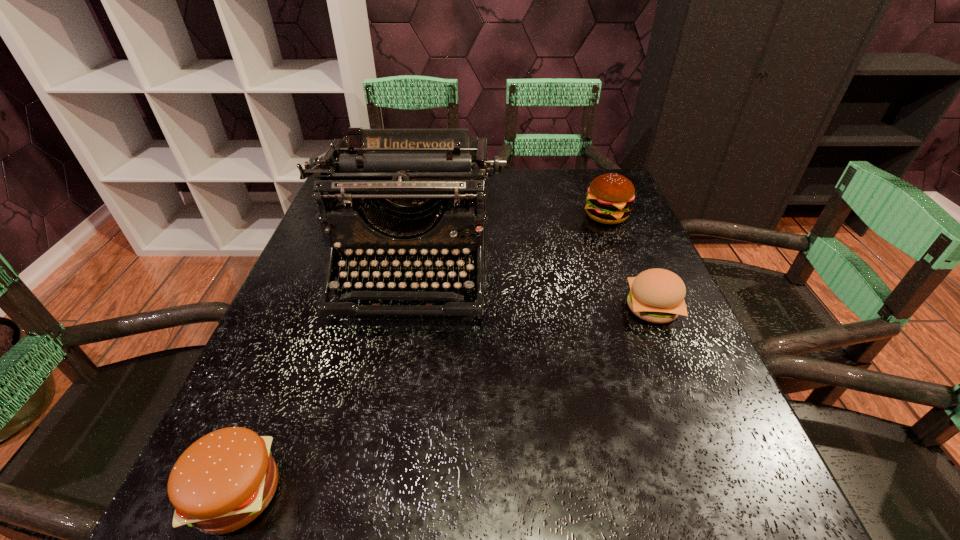
You are a GUI agent. You are given a task and a screenshot of the screen. Output one action in this format:
    pyautogui.click(x=<x>, y=<y>)
    Task: Click on the tallest object
    
    Given the screenshot: What is the action you would take?
    pyautogui.click(x=419, y=170)

In order to click on the second tallest object in this screenshot , I will do `click(610, 196)`.

Where is `the tallest hamburger`? The image size is (960, 540). the tallest hamburger is located at coordinates (610, 196).

Locate an element on the screen. the second farthest hamburger is located at coordinates (656, 295).

At what (x,y) coordinates should I click in order to perform the action: click on free region located 0.110m on the typing side of the typewriter. Please return your answer as a coordinate pair (x, y). This screenshot has width=960, height=540. Looking at the image, I should click on (393, 374).

Where is `vacant space located 0.060m on the back of the farthest hamburger`? The image size is (960, 540). vacant space located 0.060m on the back of the farthest hamburger is located at coordinates (597, 191).

The width and height of the screenshot is (960, 540). What are the coordinates of `free space located on the front of the second nearest hamburger` in the screenshot? It's located at (737, 514).

The image size is (960, 540). What are the coordinates of `object that is at the far edge` in the screenshot? It's located at (610, 196).

Locate an element on the screen. object positioned at the left edge is located at coordinates (419, 170).

You are a GUI agent. You are given a task and a screenshot of the screen. Output one action in this format:
    pyautogui.click(x=<x>, y=<y>)
    Task: Click on the object present at the far right corner
    The height and width of the screenshot is (540, 960).
    Given the screenshot: What is the action you would take?
    pyautogui.click(x=610, y=196)